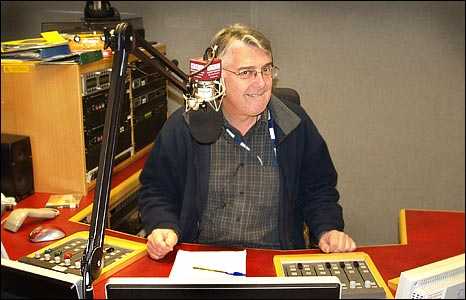
Locate an element on the screen. The height and width of the screenshot is (300, 466). scanner is located at coordinates (33, 213).